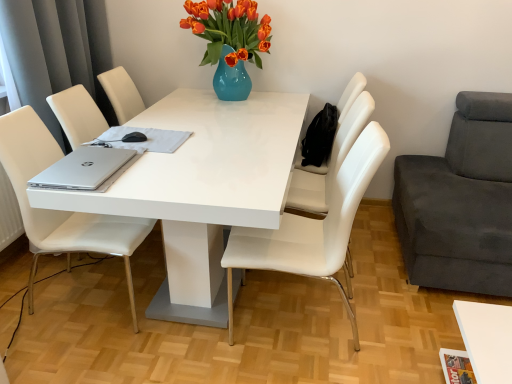
Image resolution: width=512 pixels, height=384 pixels. I want to click on vacant space underneath white leather chair at center, the 3th chair in the right-to-left sequence (from a real-world perspective), so click(x=315, y=324).